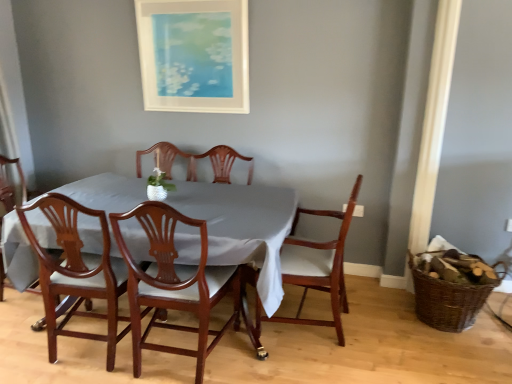
Locate an element on the screen. vacant area that is in front of brown woven basket at right is located at coordinates (463, 355).